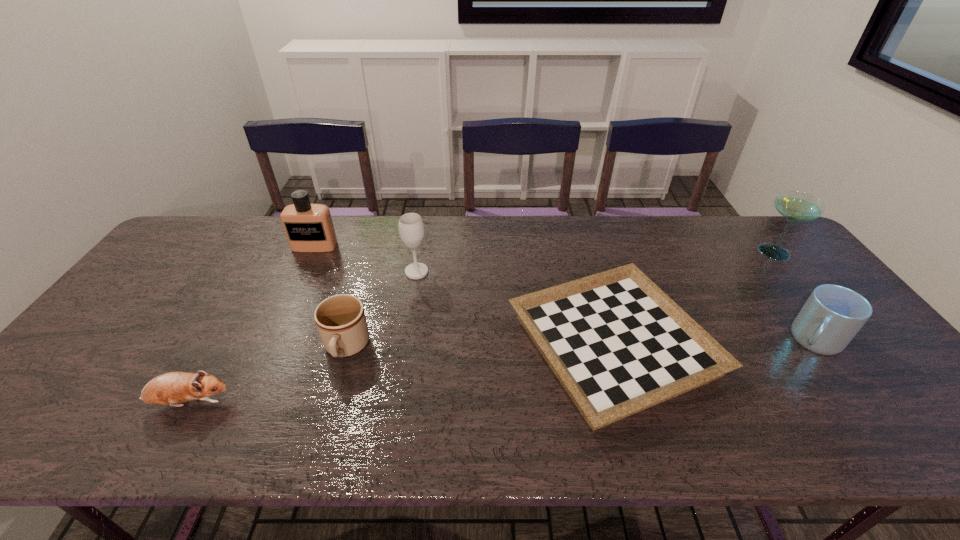
What are the coordinates of `martini` in the screenshot? It's located at (795, 206).

In order to click on perfume in this screenshot , I will do `click(309, 228)`.

Where is `wineglass`? wineglass is located at coordinates (411, 228).

Locate an element on the screen. The width and height of the screenshot is (960, 540). the right mug is located at coordinates (831, 317).

This screenshot has width=960, height=540. I want to click on the shorter mug, so click(340, 319).

The width and height of the screenshot is (960, 540). Find the location of `the left mug`. the left mug is located at coordinates [x=340, y=319].

Locate an element on the screen. This screenshot has width=960, height=540. hamster is located at coordinates (171, 388).

Where is `checkerboard`? checkerboard is located at coordinates (618, 344).

Find the location of a particular element. This screenshot has height=540, width=960. the shortest object is located at coordinates (618, 344).

You are a GUI agent. You are given a task and a screenshot of the screen. Output one action in this format:
    pyautogui.click(x=<x>, y=<y>)
    Task: Click on the free spot located on the front of the martini
    This screenshot has height=540, width=960.
    Given the screenshot: What is the action you would take?
    pyautogui.click(x=865, y=363)